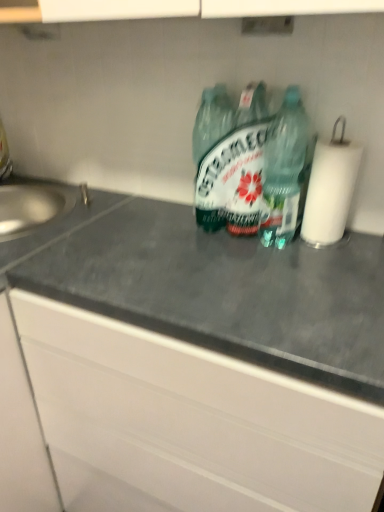
Question: Considering the positions of gray matte countertop at center and white paper at right in the image, is gray matte countertop at center bigger or smaller than white paper at right?

Choices:
 (A) small
 (B) big

Answer: (B)

Question: Is gray matte countertop at center wider or thinner than white paper at right?

Choices:
 (A) thin
 (B) wide

Answer: (B)

Question: Which is nearer to the green glass bottle at center, which is the second bottle in right-to-left order?

Choices:
 (A) green translucent bottle at center, which appears as the second bottle when viewed from the left
 (B) gray matte countertop at center
 (C) satin silver sink at left
 (D) white paper at right

Answer: (A)

Question: Which of these objects is positioned farthest from the green glass bottle at center, positioned as the 1th bottle in left-to-right order?

Choices:
 (A) white paper at right
 (B) satin silver sink at left
 (C) green translucent bottle at center, which appears as the second bottle when viewed from the left
 (D) gray matte countertop at center

Answer: (B)